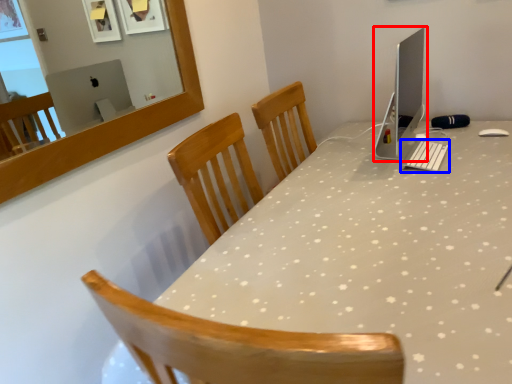
Question: Among these objects, which one is nearest to the camera, computer monitor (highlighted by a red box) or keyboard (highlighted by a blue box)?

Choices:
 (A) computer monitor
 (B) keyboard

Answer: (A)